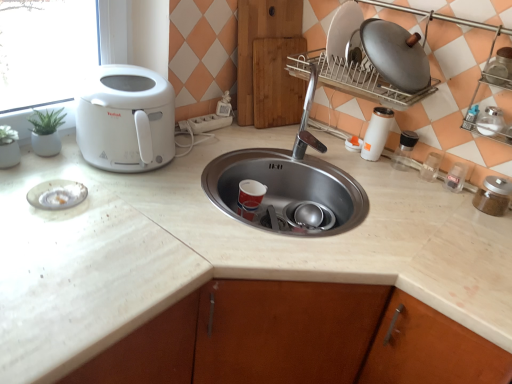
Image resolution: width=512 pixels, height=384 pixels. I want to click on free spot in front of clear plastic container at right, arranged as the fifth appliance when viewed from the left, so click(x=439, y=199).